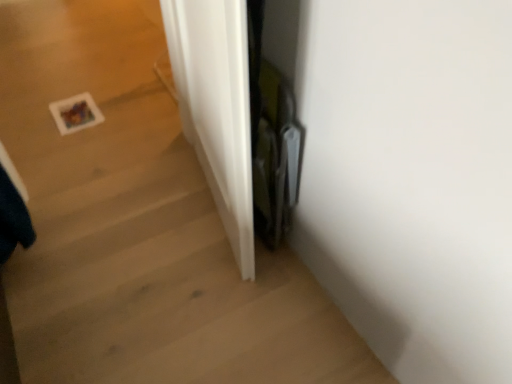
Where is `vacant space in front of black glossy screen door at center`? The width and height of the screenshot is (512, 384). vacant space in front of black glossy screen door at center is located at coordinates (274, 296).